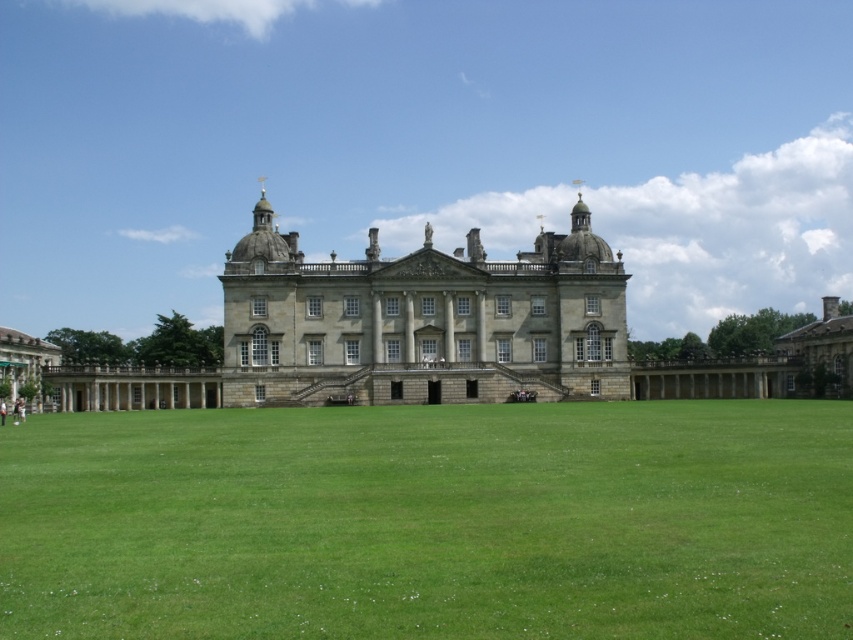
Which is in front, point (187, 464) or point (343, 312)?

Point (187, 464) is more forward.

Looking at this image, between green grass at center and stone gray palace at center, which one is positioned lower?

Positioned lower is green grass at center.

This screenshot has width=853, height=640. I want to click on green grass at center, so click(x=431, y=522).

The image size is (853, 640). I want to click on green grass at center, so click(431, 522).